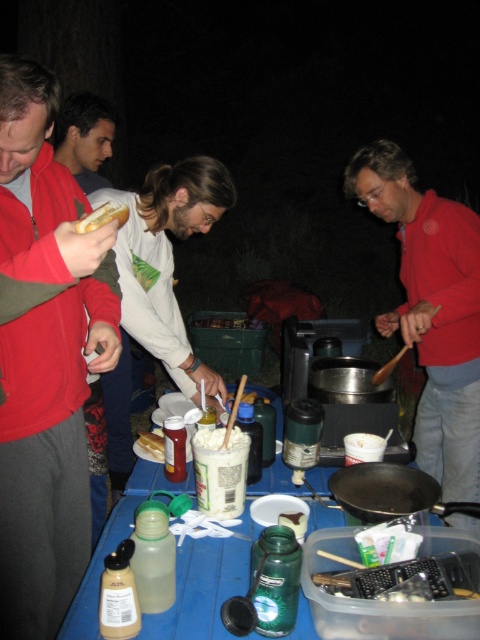
Based on the scene described, which object is positioned to the right of the other? The matte red jacket at left or the smooth brown hair at center?

The matte red jacket at left is to the right of smooth brown hair at center.